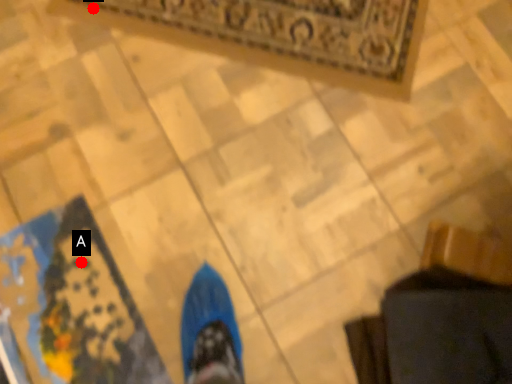
Question: Two points are circled on the image, labeled by A and B beside each circle. Which point is closer to the camera?

Choices:
 (A) A is closer
 (B) B is closer

Answer: (A)